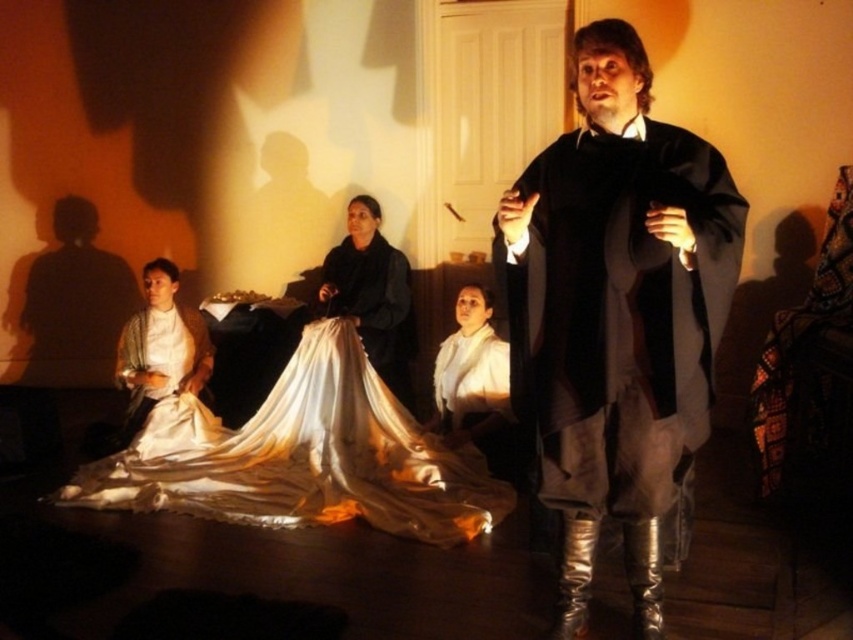
Between point (367, 264) and point (462, 326), which one is positioned behind?

Positioned behind is point (367, 264).

Can you confirm if silky white gown at center is positioned below white satin dress at center?

Actually, silky white gown at center is above white satin dress at center.

The width and height of the screenshot is (853, 640). What do you see at coordinates (372, 294) in the screenshot? I see `silky white gown at center` at bounding box center [372, 294].

Locate an element on the screen. This screenshot has height=640, width=853. silky white gown at center is located at coordinates (372, 294).

Is silky white dress at lower left bigger than white satin dress at center?

Indeed, silky white dress at lower left has a larger size compared to white satin dress at center.

Locate an element on the screen. silky white dress at lower left is located at coordinates (302, 456).

The image size is (853, 640). Find the location of `silky white dress at lower left`. silky white dress at lower left is located at coordinates coord(302,456).

Looking at this image, who is positioned more to the right, silky white gown at center or satin white dress at lower left?

silky white gown at center is more to the right.

This screenshot has height=640, width=853. What do you see at coordinates (372, 294) in the screenshot? I see `silky white gown at center` at bounding box center [372, 294].

This screenshot has width=853, height=640. I want to click on silky white gown at center, so click(372, 294).